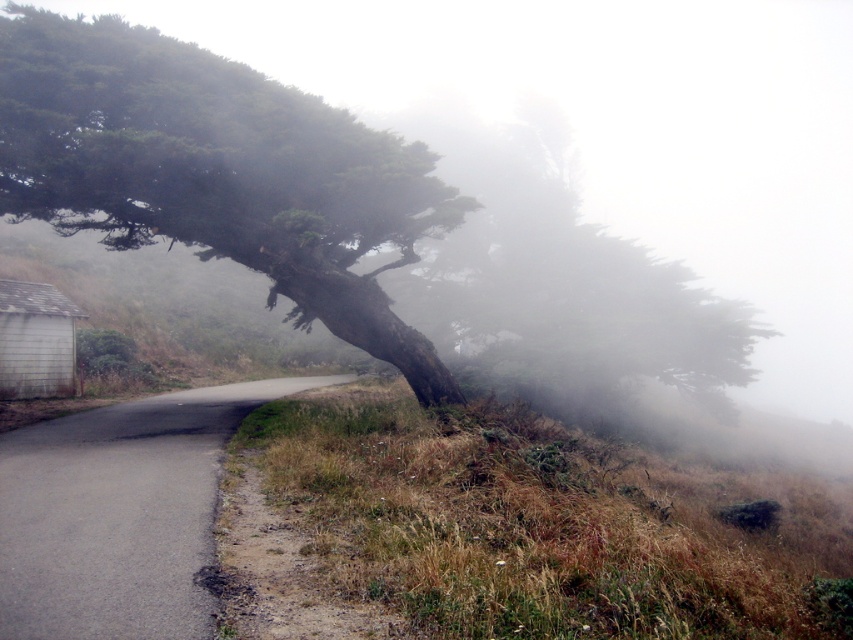
Question: Can you confirm if green rough bark tree at upper left is thinner than asphalt road at lower left?

Choices:
 (A) yes
 (B) no

Answer: (B)

Question: Which of the following is the closest to the observer?

Choices:
 (A) dry grass at lower right
 (B) green rough bark tree at upper left

Answer: (A)

Question: Which of the following is the farthest from the observer?

Choices:
 (A) (299, 476)
 (B) (125, 129)

Answer: (B)

Question: Which point is farther from the camera taking this photo?

Choices:
 (A) (59, 77)
 (B) (669, 605)
 (C) (180, 412)

Answer: (C)

Question: Can you confirm if dry grass at lower right is thinner than asphalt road at lower left?

Choices:
 (A) yes
 (B) no

Answer: (B)

Question: Is green rough bark tree at upper left further to the viewer compared to asphalt road at lower left?

Choices:
 (A) yes
 (B) no

Answer: (A)